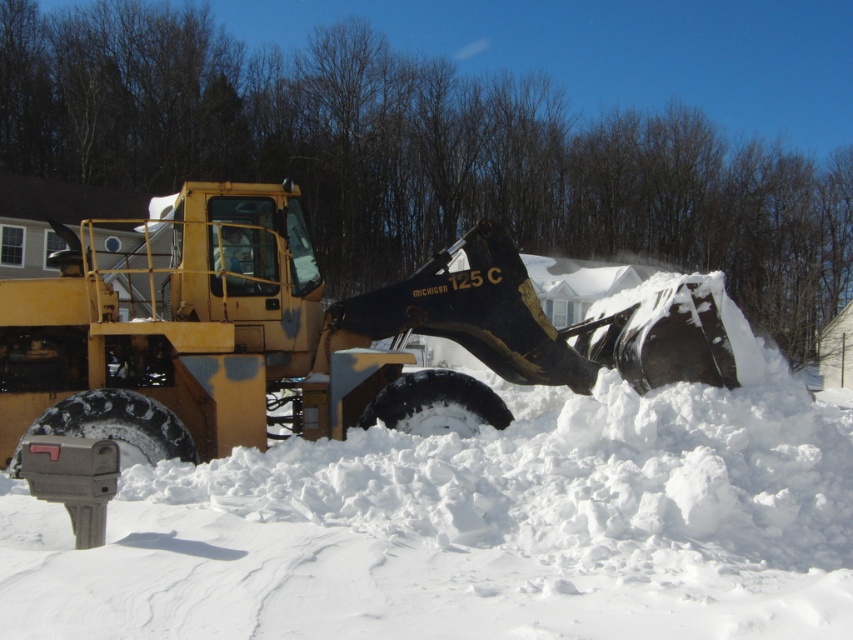
Is point (750, 467) less distant than point (300, 388)?

Yes.

Which is in front, point (354, 616) or point (384, 337)?

Positioned in front is point (354, 616).

This screenshot has height=640, width=853. I want to click on white fluffy snow at center, so click(x=476, y=525).